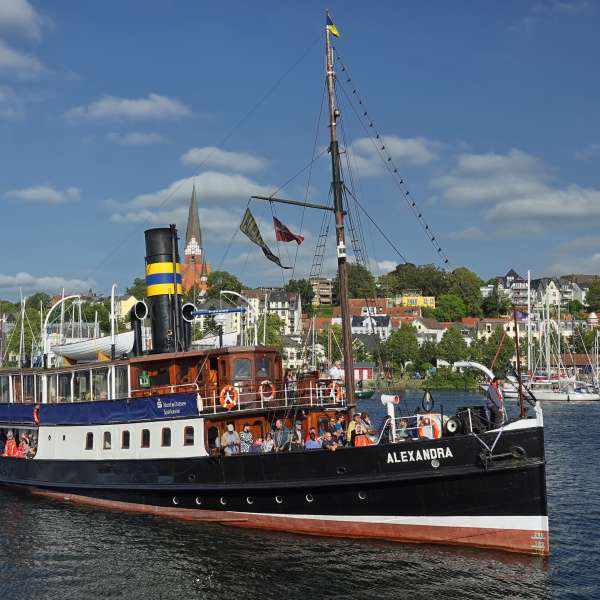
Where is `window`? The height and width of the screenshot is (600, 600). window is located at coordinates (188, 436).